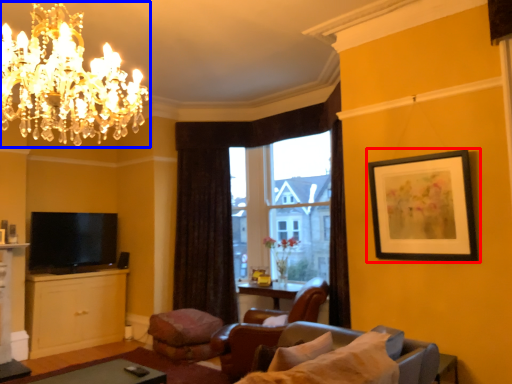
Question: Which object is closer to the camera taking this photo, picture frame (highlighted by a red box) or chandelier (highlighted by a blue box)?

Choices:
 (A) picture frame
 (B) chandelier

Answer: (B)